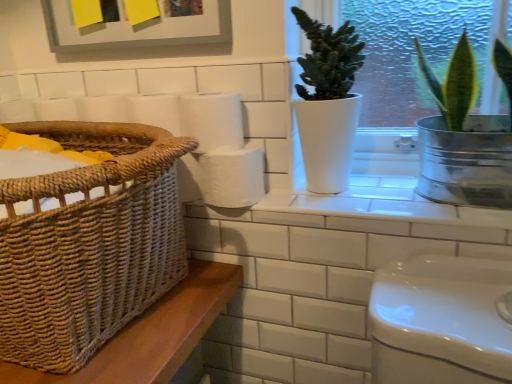
Question: From the image's perspective, is white matte pot at center, the second houseplant positioned from the right, located above or below white matte toilet paper at center?

Choices:
 (A) below
 (B) above

Answer: (B)

Question: Is white matte pot at center, the second houseplant positioned from the right, wider or thinner than white matte toilet paper at center?

Choices:
 (A) thin
 (B) wide

Answer: (B)

Question: Considering the real-world distances, which object is closest to the white matte pot at center, the second houseplant positioned from the right?

Choices:
 (A) woven brown basket at left
 (B) white matte toilet paper at center
 (C) metallic silver pot at upper right, which is counted as the second houseplant, starting from the left
 (D) white matte paper towel at center
 (E) white ceramic window sill at upper center

Answer: (E)

Question: Estimate the real-world distances between objects in this image. Which object is farther from the white matte paper towel at center?

Choices:
 (A) metallic silver pot at upper right, which is counted as the second houseplant, starting from the left
 (B) white matte toilet paper at center
 (C) white ceramic window sill at upper center
 (D) white matte pot at center, the 1th houseplant viewed from the left
 (E) woven brown basket at left

Answer: (A)